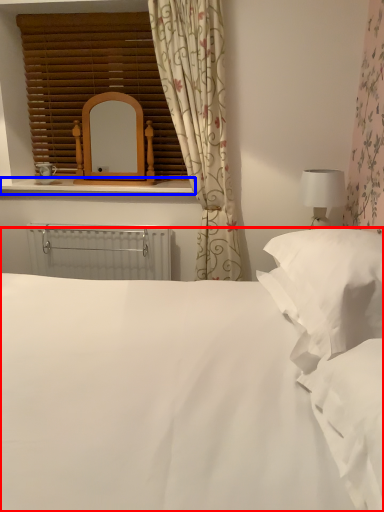
Question: Which object appears closest to the camera in this image, bed (highlighted by a red box) or window sill (highlighted by a blue box)?

Choices:
 (A) bed
 (B) window sill

Answer: (A)